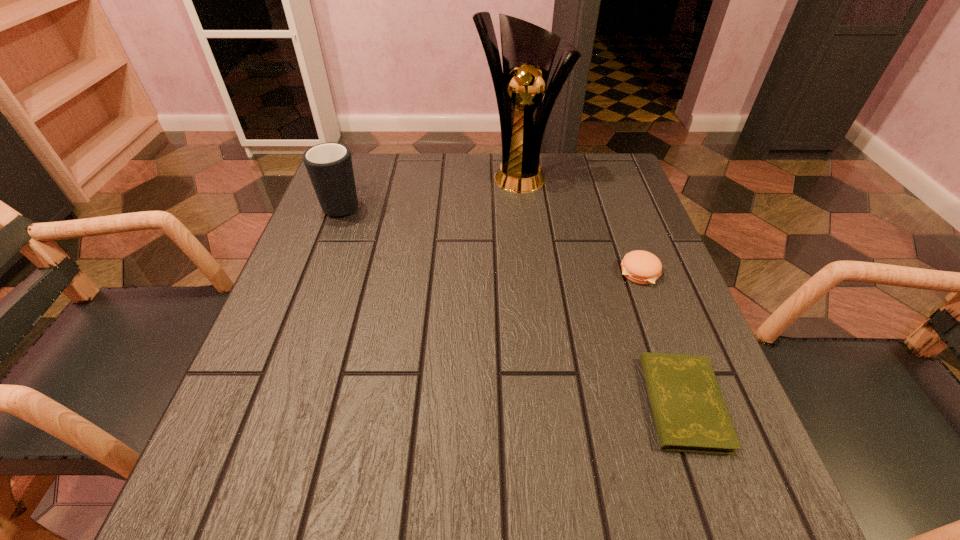
At what (x,y) coordinates should I click in order to perform the action: click on free location at the far edge of the desktop. Please return your answer as a coordinate pair (x, y). Image resolution: width=960 pixels, height=540 pixels. Looking at the image, I should click on (430, 183).

Image resolution: width=960 pixels, height=540 pixels. Find the location of `vacant space at the near edge of the desktop`. vacant space at the near edge of the desktop is located at coordinates coord(605,510).

In the image, there is a desktop. At what (x,y) coordinates should I click in order to perform the action: click on free region at the left edge. Please return your answer as a coordinate pair (x, y). This screenshot has width=960, height=540. Looking at the image, I should click on (292, 431).

Locate an element on the screen. The width and height of the screenshot is (960, 540). free region at the right edge of the desktop is located at coordinates (632, 228).

In the image, there is a desktop. In order to click on vacant space at the far left corner in this screenshot , I will do (x=375, y=177).

Where is `vacant area at the far right corner`? vacant area at the far right corner is located at coordinates 637,196.

What are the coordinates of `vacant space at the near right corner of the desktop` in the screenshot? It's located at (778, 517).

The height and width of the screenshot is (540, 960). I want to click on unoccupied position between the nearest object and the patty, so click(x=661, y=338).

Where is `free space between the second shortest object and the mug`? The width and height of the screenshot is (960, 540). free space between the second shortest object and the mug is located at coordinates (492, 238).

The image size is (960, 540). What are the coordinates of `free space between the diary and the second nearest object` in the screenshot? It's located at (661, 338).